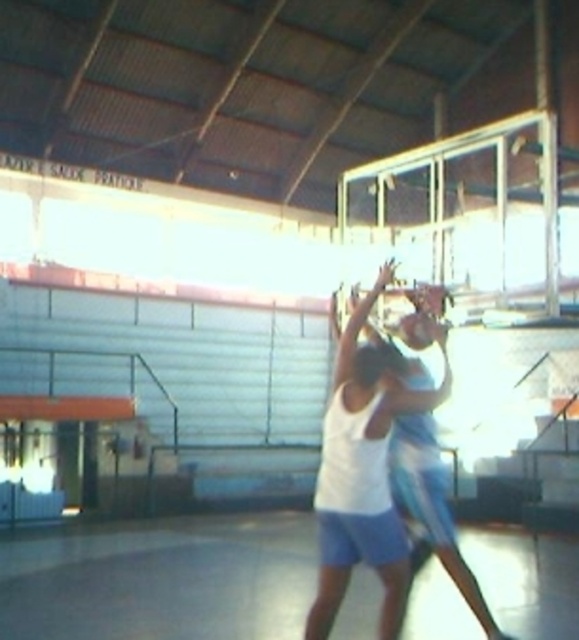
Question: Is smooth concrete floor at center to the right of white matte basketball at center from the viewer's perspective?

Choices:
 (A) no
 (B) yes

Answer: (A)

Question: Does smooth concrete floor at center appear over white matte basketball at center?

Choices:
 (A) yes
 (B) no

Answer: (B)

Question: Which object is closer to the camera taking this photo?

Choices:
 (A) smooth concrete floor at center
 (B) white matte basketball at center

Answer: (B)

Question: Among these objects, which one is farthest from the camera?

Choices:
 (A) smooth concrete floor at center
 (B) white matte basketball at center

Answer: (A)

Question: Is smooth concrete floor at center below white matte basketball at center?

Choices:
 (A) yes
 (B) no

Answer: (A)